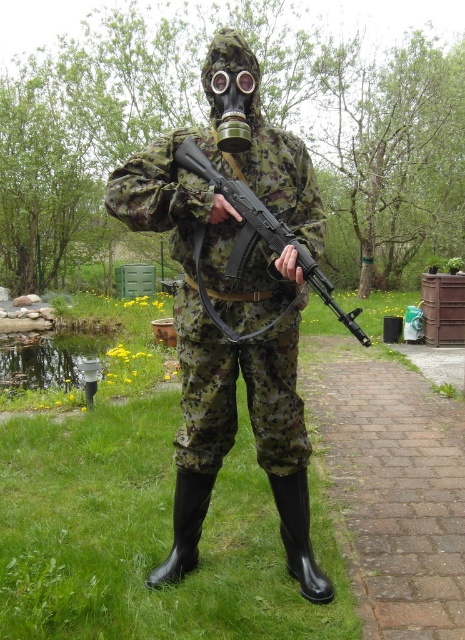
Question: Among these objects, which one is nearest to the camera?

Choices:
 (A) camouflage fabric uniform at center
 (B) matte black rifle at center

Answer: (B)

Question: Does camouflage fabric uniform at center have a larger size compared to matte black rifle at center?

Choices:
 (A) no
 (B) yes

Answer: (B)

Question: Which point is farther to the camera?

Choices:
 (A) camouflage fabric uniform at center
 (B) matte black rifle at center

Answer: (A)

Question: Considering the relative positions of camouflage fabric uniform at center and matte black rifle at center in the image provided, where is camouflage fabric uniform at center located with respect to matte black rifle at center?

Choices:
 (A) right
 (B) left

Answer: (B)

Question: In this image, where is camouflage fabric uniform at center located relative to matte black rifle at center?

Choices:
 (A) left
 (B) right

Answer: (A)